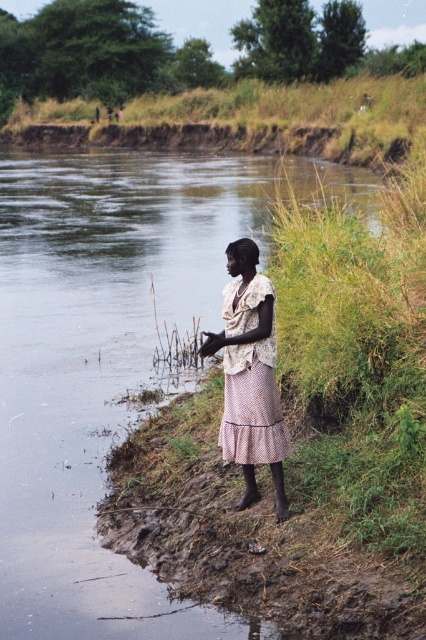
You are a photographer standing at the riverside. You want to capture the light beige lace blouse at center in your photo. Where should you position your camera to ensure the blouse is centered in the frame?

To center the light beige lace blouse at center in the frame, position your camera at the point corresponding to the coordinates provided in the scene description, which is at point (250, 376).

You are a photographer trying to capture the girl in the scene. The light beige lace blouse at center and brown dirt at upper center are both in the frame. Which object is positioned lower in the image?

The light beige lace blouse at center is positioned lower than the brown dirt at upper center because it has a lesser height compared to it.

You are a photographer standing near the camera. You want to capture a closeup shot of the light beige lace blouse at center. Can you do so without moving the camera?

The light beige lace blouse at center and camera are 7.11 meters apart. To capture a closeup shot without moving the camera, you would need a zoom lens capable of focusing at that distance.